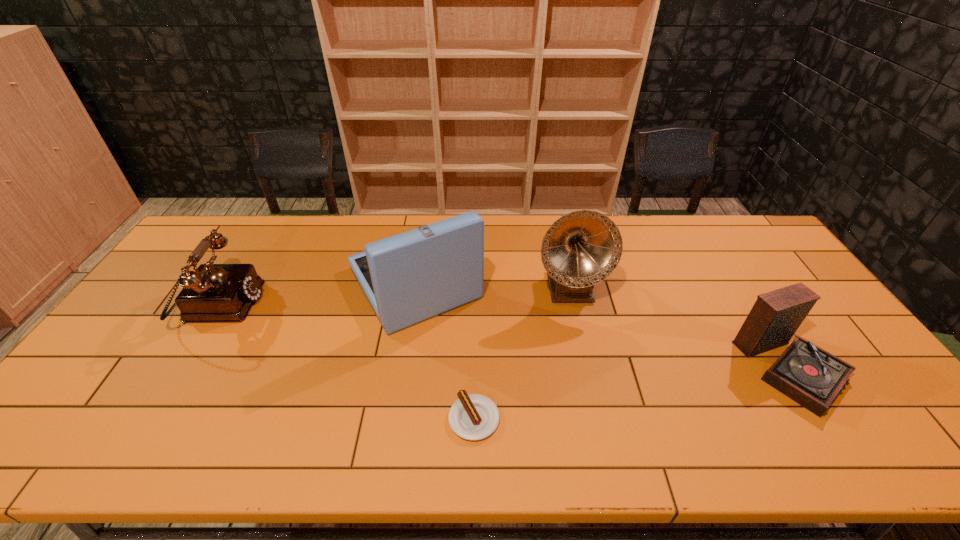
Select which object is the fourth closest to the second object from right to left. Please provide its 2D coordinates. Your answer should be formatted as a tuple, i.e. [(x, y)], where the tuple contains the x and y coordinates of a point satisfying the conditions above.

[(213, 292)]

Identify the location of the third closest object to the rightmost object. (408, 278).

Locate an element on the screen. the closest phonograph record to the leftmost phonograph record is located at coordinates (582, 248).

Choose which phonograph record is the nearest neighbor to the sausage. Please provide its 2D coordinates. Your answer should be formatted as a tuple, i.e. [(x, y)], where the tuple contains the x and y coordinates of a point satisfying the conditions above.

[(408, 278)]

The image size is (960, 540). I want to click on vacant point that satisfies the following two spatial constraints: 1. on the front side of the rightmost phonograph record; 2. on the right side of the leftmost phonograph record, so click(401, 367).

The width and height of the screenshot is (960, 540). I want to click on vacant space that satisfies the following two spatial constraints: 1. on the back side of the sausage; 2. on the dial of the telephone, so click(475, 305).